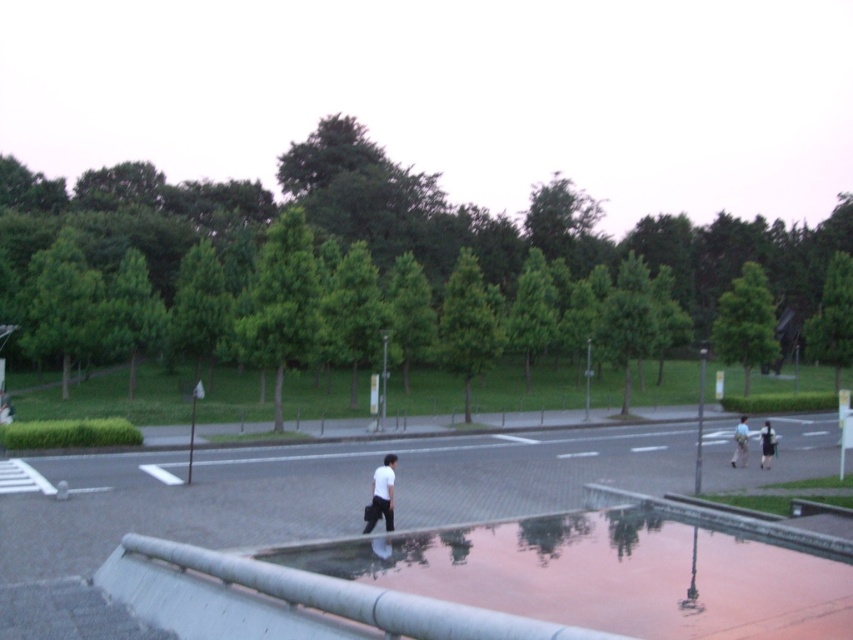
Question: Is white matte shirt at center thinner than light blue shirt at right?

Choices:
 (A) yes
 (B) no

Answer: (A)

Question: Does white matte shirt at center appear on the right side of dark blue jeans at center?

Choices:
 (A) no
 (B) yes

Answer: (A)

Question: Which point is closer to the camera taking this photo?

Choices:
 (A) (381, 470)
 (B) (740, 419)
 (C) (769, 424)
 (D) (668, 573)

Answer: (D)

Question: Which object is farther from the camera taking this photo?

Choices:
 (A) reflective glass puddle at center
 (B) dark blue jeans at center
 (C) light blue shirt at right

Answer: (B)

Question: Can you confirm if white matte shirt at center is positioned to the left of light blue shirt at right?

Choices:
 (A) no
 (B) yes

Answer: (B)

Question: Among these objects, which one is farthest from the camera?

Choices:
 (A) white matte shirt at center
 (B) dark blue jeans at center
 (C) light blue shirt at right

Answer: (B)